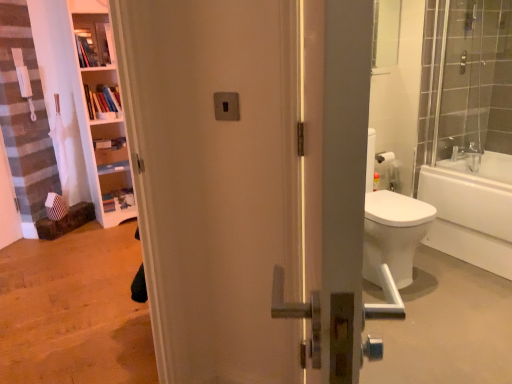
Question: Is wooden bookshelf at upper left, the first shelf from the bottom, facing towards wooden shelves at upper left, positioned as the first shelf in top-to-bottom order?

Choices:
 (A) yes
 (B) no

Answer: (B)

Question: Is wooden shelves at upper left, positioned as the first shelf in top-to-bottom order, surrounded by wooden bookshelf at upper left, the first shelf from the bottom?

Choices:
 (A) no
 (B) yes

Answer: (A)

Question: Is wooden bookshelf at upper left, placed as the second shelf when sorted from top to bottom, taller than wooden shelves at upper left, positioned as the first shelf in top-to-bottom order?

Choices:
 (A) no
 (B) yes

Answer: (A)

Question: Does wooden bookshelf at upper left, placed as the second shelf when sorted from top to bottom, have a lesser height compared to wooden shelves at upper left, positioned as the first shelf in top-to-bottom order?

Choices:
 (A) yes
 (B) no

Answer: (A)

Question: Considering the relative sizes of wooden bookshelf at upper left, placed as the second shelf when sorted from top to bottom, and wooden shelves at upper left, positioned as the first shelf in top-to-bottom order, in the image provided, is wooden bookshelf at upper left, placed as the second shelf when sorted from top to bottom, smaller than wooden shelves at upper left, positioned as the first shelf in top-to-bottom order,?

Choices:
 (A) yes
 (B) no

Answer: (B)

Question: Would you say wooden bookshelf at upper left, placed as the second shelf when sorted from top to bottom, is to the left or to the right of white glossy bathtub at right in the picture?

Choices:
 (A) left
 (B) right

Answer: (A)

Question: Is point (88, 82) closer or farther from the camera than point (477, 182)?

Choices:
 (A) closer
 (B) farther

Answer: (B)

Question: In terms of width, does wooden bookshelf at upper left, placed as the second shelf when sorted from top to bottom, look wider or thinner when compared to white glossy bathtub at right?

Choices:
 (A) wide
 (B) thin

Answer: (B)

Question: From the image's perspective, is wooden bookshelf at upper left, the first shelf from the bottom, located above or below white glossy bathtub at right?

Choices:
 (A) below
 (B) above

Answer: (B)

Question: From the image's perspective, is wooden shelves at upper left, positioned as the first shelf in top-to-bottom order, above or below wooden bookshelf at upper left, placed as the second shelf when sorted from top to bottom?

Choices:
 (A) below
 (B) above

Answer: (B)

Question: In the image, is wooden shelves at upper left, positioned as the second shelf in bottom-to-top order, on the left side or the right side of wooden bookshelf at upper left, the first shelf from the bottom?

Choices:
 (A) left
 (B) right

Answer: (A)

Question: In the image, is wooden shelves at upper left, positioned as the second shelf in bottom-to-top order, positioned in front of or behind wooden bookshelf at upper left, placed as the second shelf when sorted from top to bottom?

Choices:
 (A) front
 (B) behind

Answer: (A)

Question: Is wooden shelves at upper left, positioned as the first shelf in top-to-bottom order, taller or shorter than wooden bookshelf at upper left, placed as the second shelf when sorted from top to bottom?

Choices:
 (A) short
 (B) tall

Answer: (B)

Question: From the image's perspective, is clear glass shower door at right above or below white glossy bathtub at right?

Choices:
 (A) below
 (B) above

Answer: (B)

Question: Considering the positions of clear glass shower door at right and white glossy bathtub at right in the image, is clear glass shower door at right bigger or smaller than white glossy bathtub at right?

Choices:
 (A) small
 (B) big

Answer: (A)